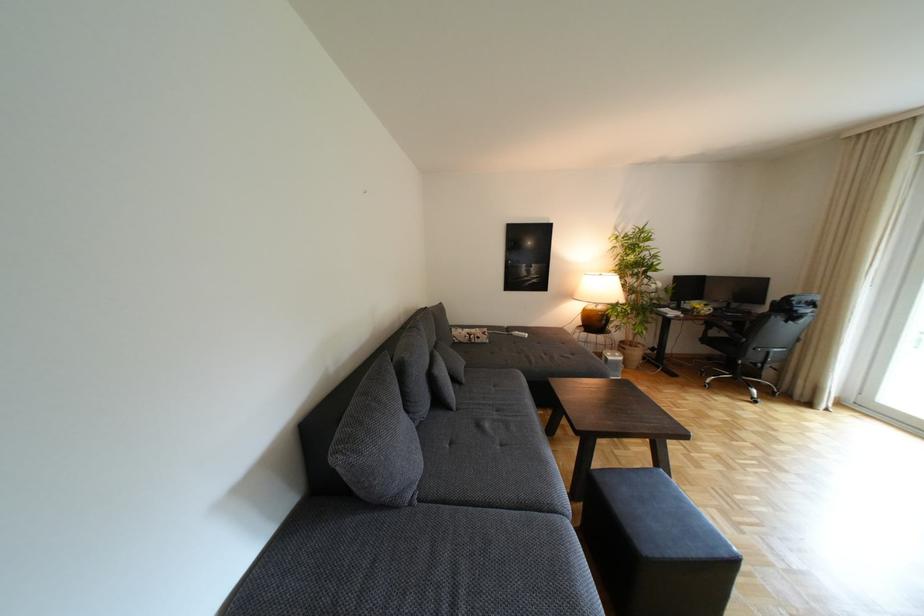
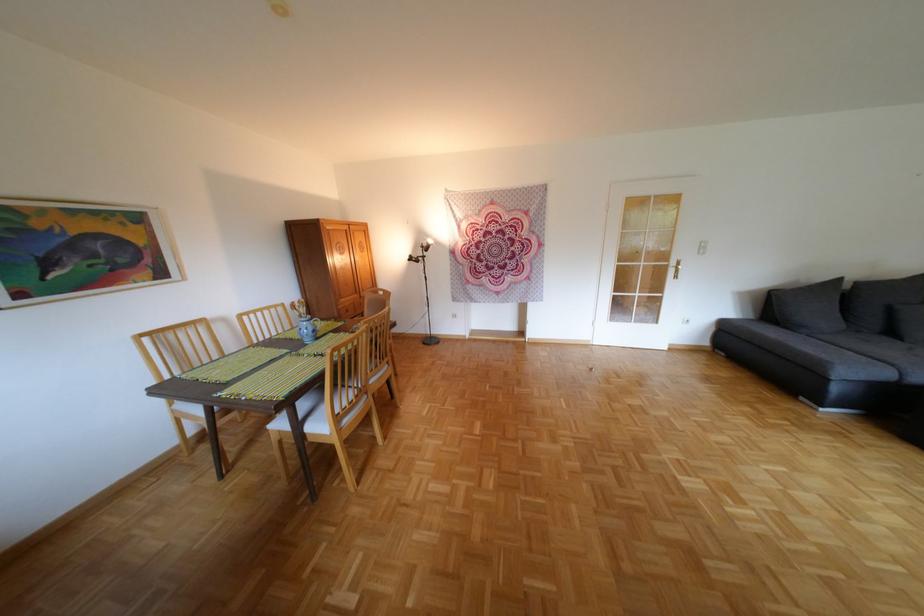
Where in the second image is the point corresponding to pixel 566 509 from the first image?

(906, 365)